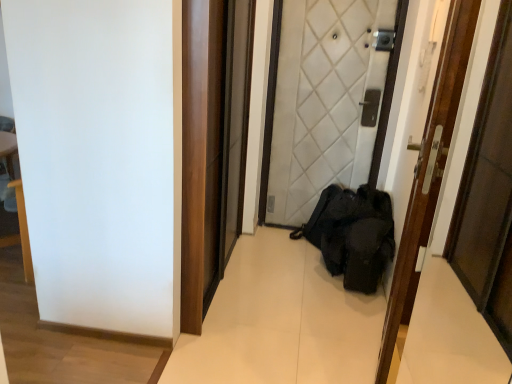
Question: Is the depth of white quilted fabric door at center, which is the second door from front to back, greater than that of wooden door at center, which is the second door in back-to-front order?

Choices:
 (A) no
 (B) yes

Answer: (B)

Question: Considering the relative positions of white quilted fabric door at center, the 1th door when ordered from back to front, and wooden door at center, the 1th door in the front-to-back sequence, in the image provided, is white quilted fabric door at center, the 1th door when ordered from back to front, to the left of wooden door at center, the 1th door in the front-to-back sequence, from the viewer's perspective?

Choices:
 (A) yes
 (B) no

Answer: (A)

Question: Can you confirm if white quilted fabric door at center, the 1th door when ordered from back to front, is thinner than wooden door at center, the 1th door in the front-to-back sequence?

Choices:
 (A) yes
 (B) no

Answer: (B)

Question: Is white quilted fabric door at center, the 1th door when ordered from back to front, positioned beyond the bounds of wooden door at center, the 1th door in the front-to-back sequence?

Choices:
 (A) no
 (B) yes

Answer: (B)

Question: Is white quilted fabric door at center, which is the second door from front to back, facing towards wooden door at center, which is the second door in back-to-front order?

Choices:
 (A) no
 (B) yes

Answer: (B)

Question: From a real-world perspective, is white quilted fabric door at center, which is the second door from front to back, physically above wooden door at center, the 1th door in the front-to-back sequence?

Choices:
 (A) no
 (B) yes

Answer: (B)

Question: Can you confirm if wooden door at center, the 1th door in the front-to-back sequence, is bigger than white quilted fabric door at center, which is the second door from front to back?

Choices:
 (A) no
 (B) yes

Answer: (A)

Question: Considering the relative positions of wooden door at center, which is the second door in back-to-front order, and white quilted fabric door at center, which is the second door from front to back, in the image provided, is wooden door at center, which is the second door in back-to-front order, in front of white quilted fabric door at center, which is the second door from front to back,?

Choices:
 (A) no
 (B) yes

Answer: (B)

Question: Considering the relative sizes of wooden door at center, which is the second door in back-to-front order, and white quilted fabric door at center, which is the second door from front to back, in the image provided, is wooden door at center, which is the second door in back-to-front order, taller than white quilted fabric door at center, which is the second door from front to back,?

Choices:
 (A) no
 (B) yes

Answer: (A)

Question: From the image's perspective, is wooden door at center, which is the second door in back-to-front order, located beneath white quilted fabric door at center, the 1th door when ordered from back to front?

Choices:
 (A) yes
 (B) no

Answer: (A)

Question: Does wooden door at center, which is the second door in back-to-front order, appear on the right side of white quilted fabric door at center, the 1th door when ordered from back to front?

Choices:
 (A) yes
 (B) no

Answer: (A)

Question: Is wooden door at center, the 1th door in the front-to-back sequence, outside of white quilted fabric door at center, which is the second door from front to back?

Choices:
 (A) no
 (B) yes

Answer: (B)

Question: Looking at their shapes, would you say white quilted fabric door at center, the 1th door when ordered from back to front, is wider or thinner than wooden door at center, which is the second door in back-to-front order?

Choices:
 (A) wide
 (B) thin

Answer: (A)